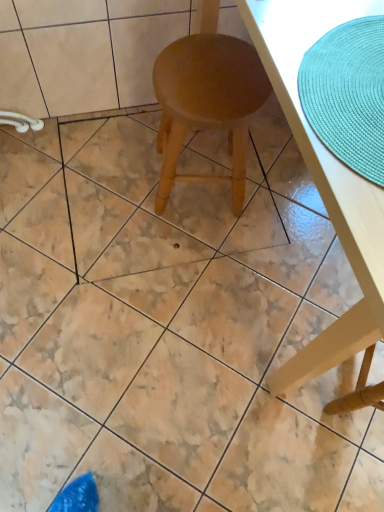
I want to click on vacant area in front of light brown wood stool at center, so click(x=188, y=262).